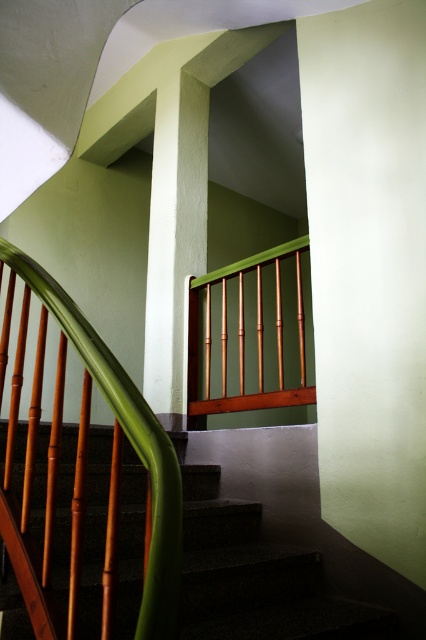
Question: Which of the following is the farthest from the observer?

Choices:
 (A) (207, 552)
 (B) (371, 204)
 (C) (287, 388)

Answer: (C)

Question: Which point appears closest to the camera in this image?

Choices:
 (A) (304, 400)
 (B) (69, 451)

Answer: (B)

Question: Does smooth concrete stairs at center have a greater width compared to smooth white pillar at center?

Choices:
 (A) yes
 (B) no

Answer: (A)

Question: Which object is positioned closest to the smooth white pillar at center?

Choices:
 (A) smooth concrete stairs at center
 (B) matte green wall at center

Answer: (B)

Question: In this image, where is smooth white pillar at center located relative to wooden balustrade at center?

Choices:
 (A) right
 (B) left

Answer: (B)

Question: Where is matte green wall at center located in relation to smooth white pillar at center in the image?

Choices:
 (A) below
 (B) above

Answer: (A)